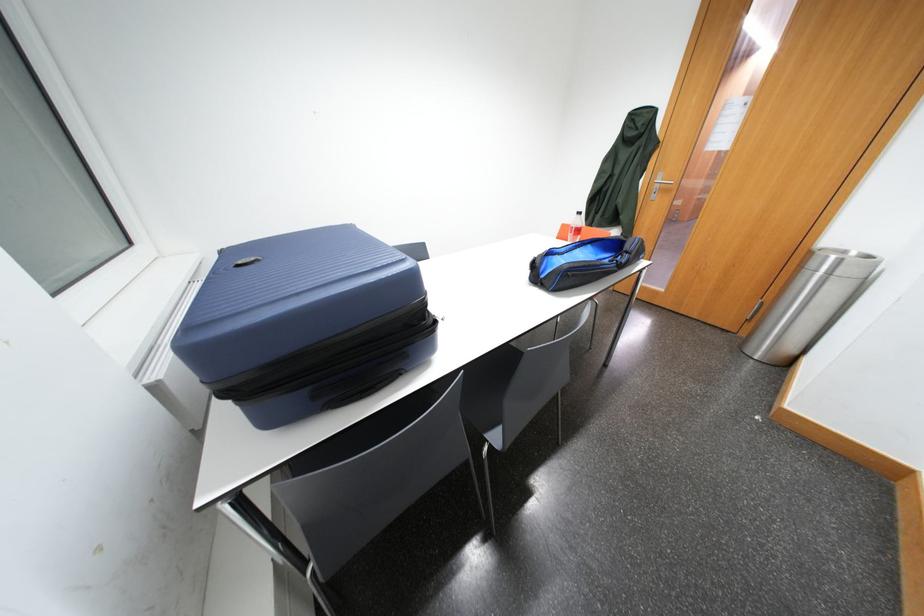
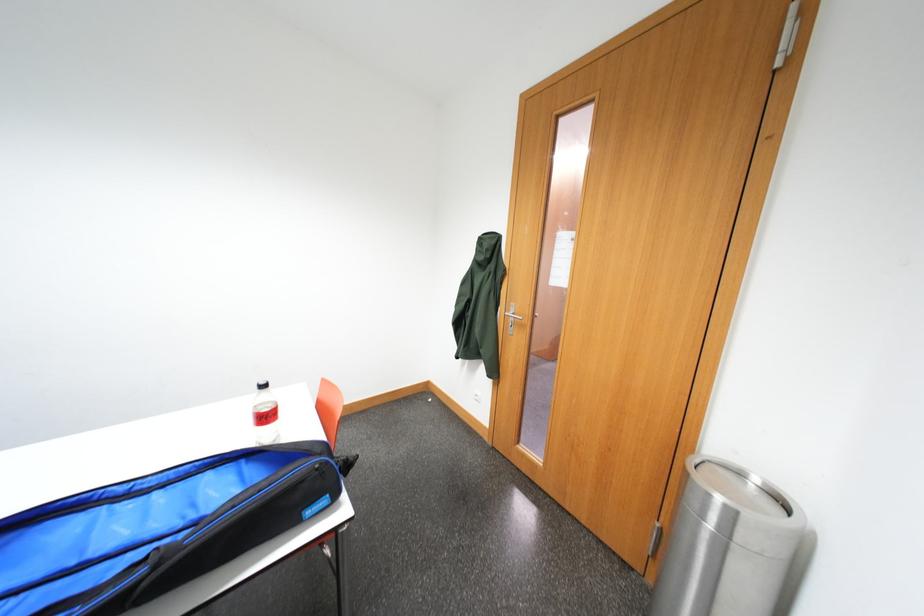
The images are taken continuously from a first-person perspective. In which direction are you moving?

The cameraman moved toward right, forward.